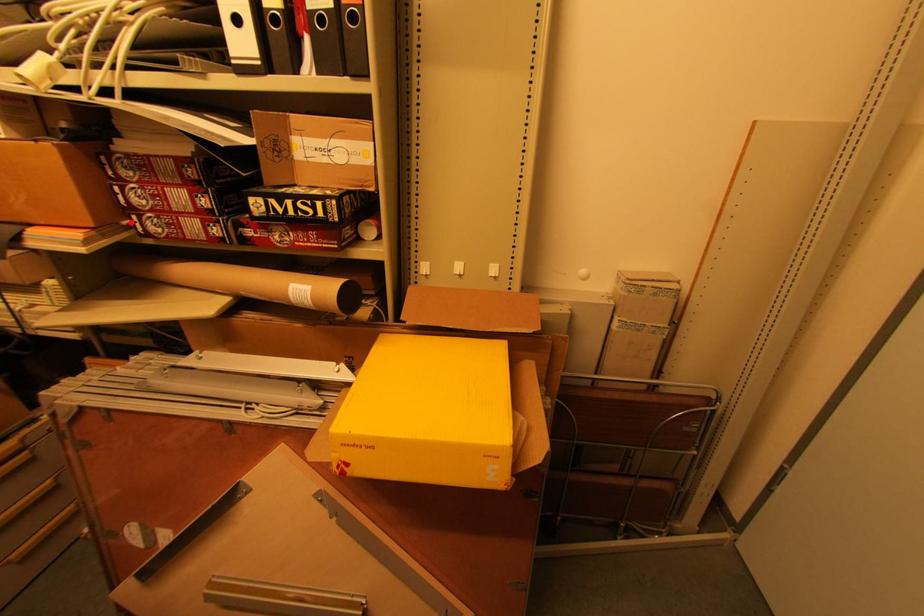
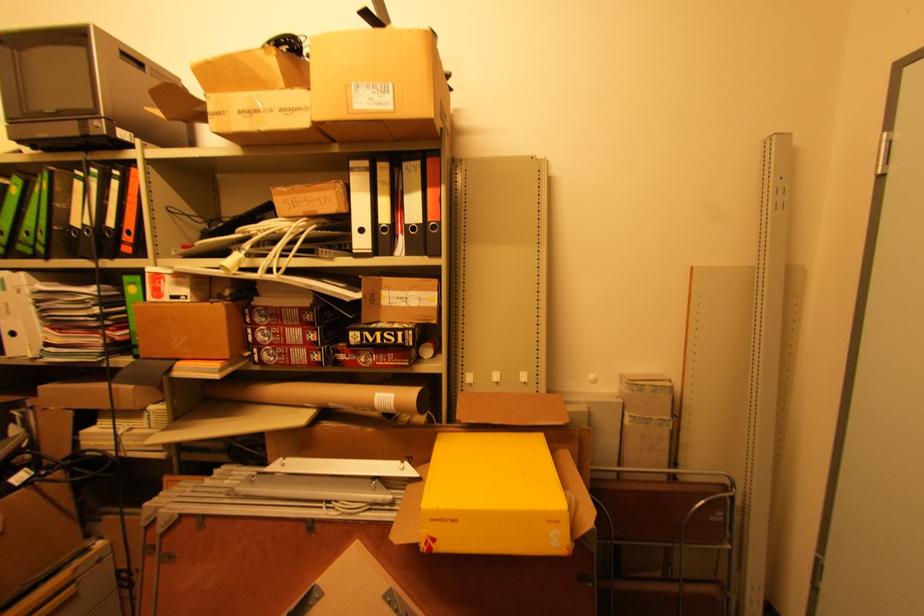
In the second image, find the point that corresponds to the highlighted location in the first image.

(251, 354)